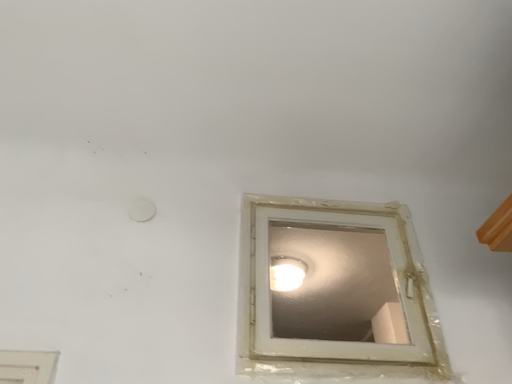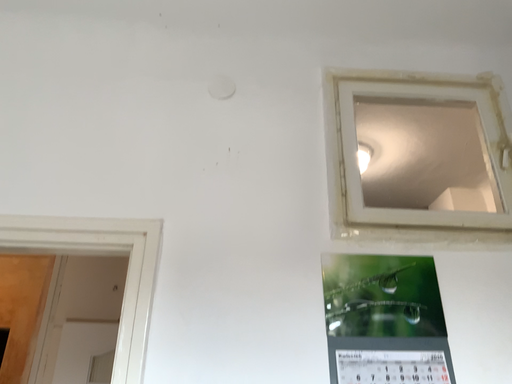
Question: How did the camera likely rotate when shooting the video?

Choices:
 (A) rotated upward
 (B) rotated downward

Answer: (B)